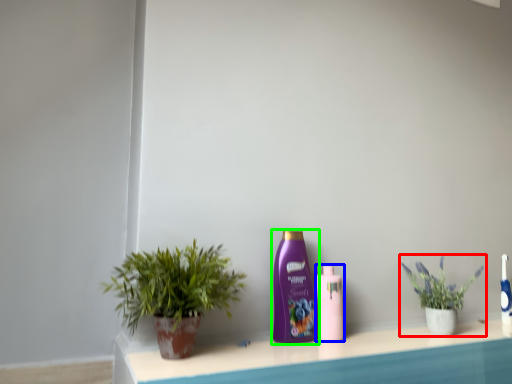
Question: Which is nearer to the houseplant (highlighted by a red box)? bottle (highlighted by a blue box) or bottle (highlighted by a green box).

Choices:
 (A) bottle
 (B) bottle

Answer: (A)